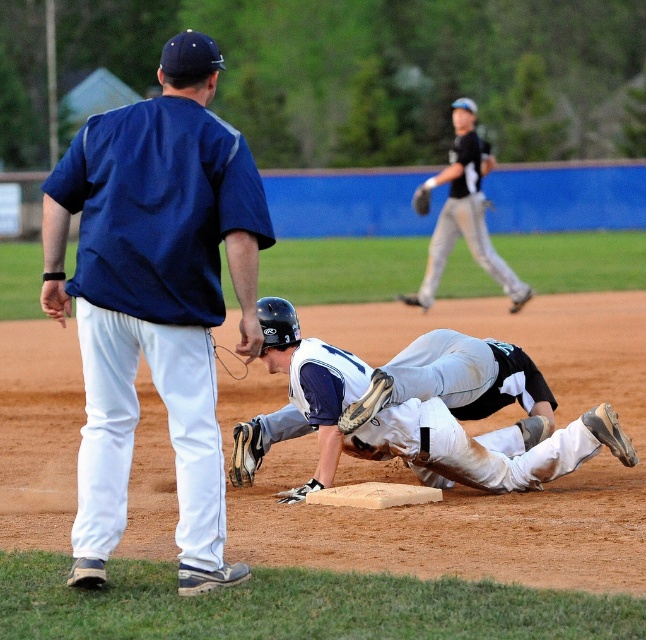
You are a spectator at the baseball game and want to know the position of the blue fabric shirt at upper left and the brown leather glove at center. Which object is closer to the left side of the image?

The blue fabric shirt at upper left is closer to the left side of the image because it is positioned to the left of the brown leather glove at center.

You are standing at the position of the viewer in the image. There is a blue fabric shirt at upper left that you want to throw a baseball to. If you can throw the ball 7 meters, will you be able to reach it?

The blue fabric shirt at upper left and viewer are 6.94 meters apart from each other. Since you can throw the ball 7 meters, you can reach the blue fabric shirt at upper left as the distance is slightly less than your throwing range.

Consider the image. You are a photographer standing at the baseline trying to capture a close shot of the sliding player. You have two points marked on your camera screen at coordinates point (x=450, y=192) and point (x=412, y=198). Which point should you focus on to ensure the player is in focus?

You should focus on point (x=450, y=192) because it is closer to the camera than point (x=412, y=198), ensuring the player is in focus.